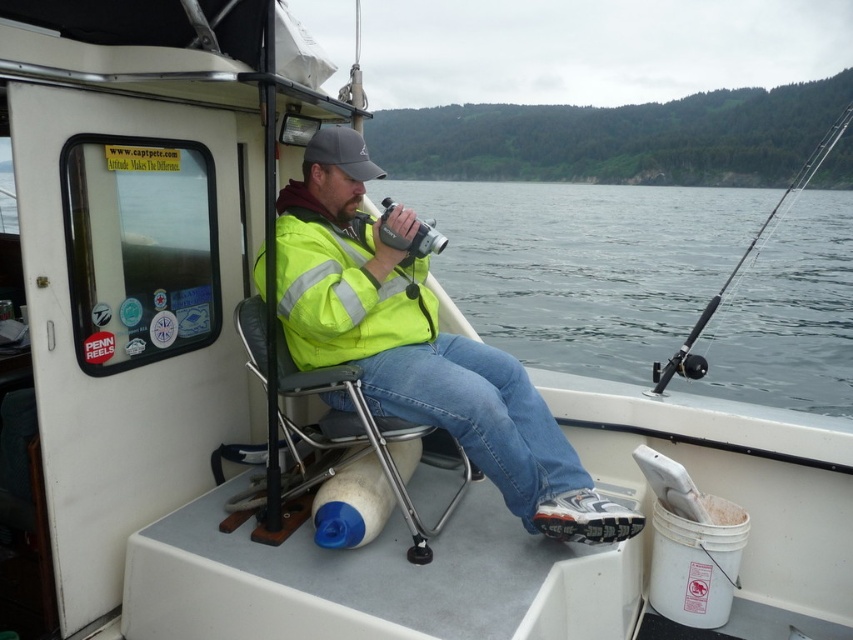
You are a photographer trying to capture a clear shot of the black plastic fishing pole at right. You are sitting on the metallic gray chair at center. Considering the height of your chair, will you need to tilt your camera upwards to get the fishing pole in frame?

The metallic gray chair at center has a lesser height compared to black plastic fishing pole at right, so yes, you will need to tilt your camera upwards to get the fishing pole in frame since the chair is shorter than the fishing pole.

You are a photographer trying to set up a tripod between the yellow reflective jacket at center and the metallic gray chair at center. The tripod requires at least 12 inches of space to be stable. Based on the scene, will there be enough space?

The distance between the yellow reflective jacket at center and the metallic gray chair at center is 10.81 inches, which is less than the required 12 inches. Therefore, there isn not enough space for the tripod to be stable.

You are on a boat and need to reach the black plastic fishing pole at right to retrieve a caught fish. Which direction should you move from the metallic gray chair at center to get to it?

You should move to the right from the metallic gray chair at center to reach the black plastic fishing pole at right since the metallic gray chair at center is to the left of the black plastic fishing pole at right.